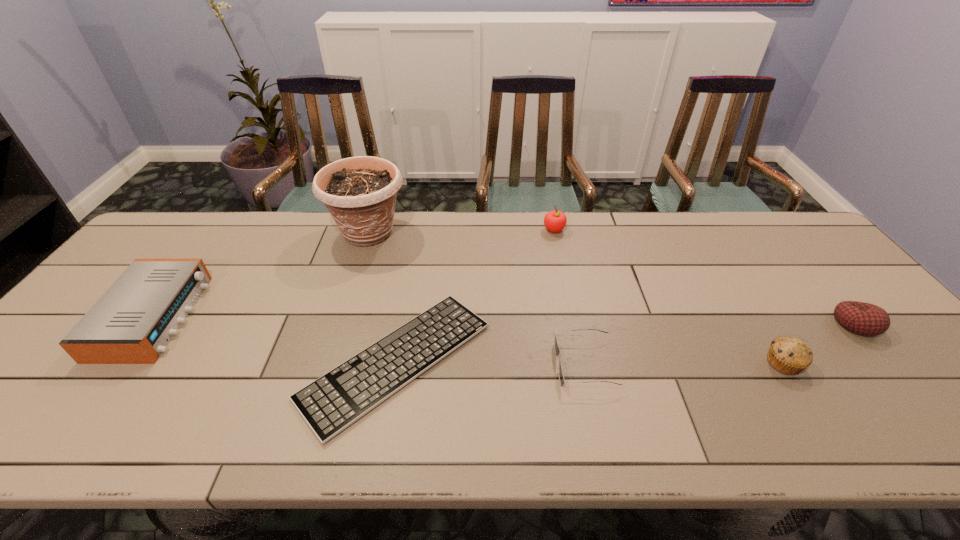
Identify the location of object positioned at the right edge. (861, 318).

Identify the location of free region at the far edge. The width and height of the screenshot is (960, 540). (479, 253).

Image resolution: width=960 pixels, height=540 pixels. In the image, there is a desktop. Find the location of `free space at the near edge`. free space at the near edge is located at coordinates (433, 435).

This screenshot has width=960, height=540. I want to click on vacant region at the right edge of the desktop, so click(x=816, y=265).

Locate an element on the screen. This screenshot has height=540, width=960. vacant space in between the computer keyboard and the sunglasses is located at coordinates (492, 362).

Identify the location of empty space that is in between the apple and the computer keyboard. (475, 295).

Identify the location of vacant area between the tallest object and the shortest object. (382, 297).

Locate an element on the screen. This screenshot has width=960, height=540. empty space between the second object from right to left and the radio receiver is located at coordinates (468, 340).

Locate an element on the screen. This screenshot has height=540, width=960. free space between the beanbag and the shortest object is located at coordinates (626, 342).

The height and width of the screenshot is (540, 960). In order to click on empty location between the muffin and the sunglasses in this screenshot , I will do `click(684, 363)`.